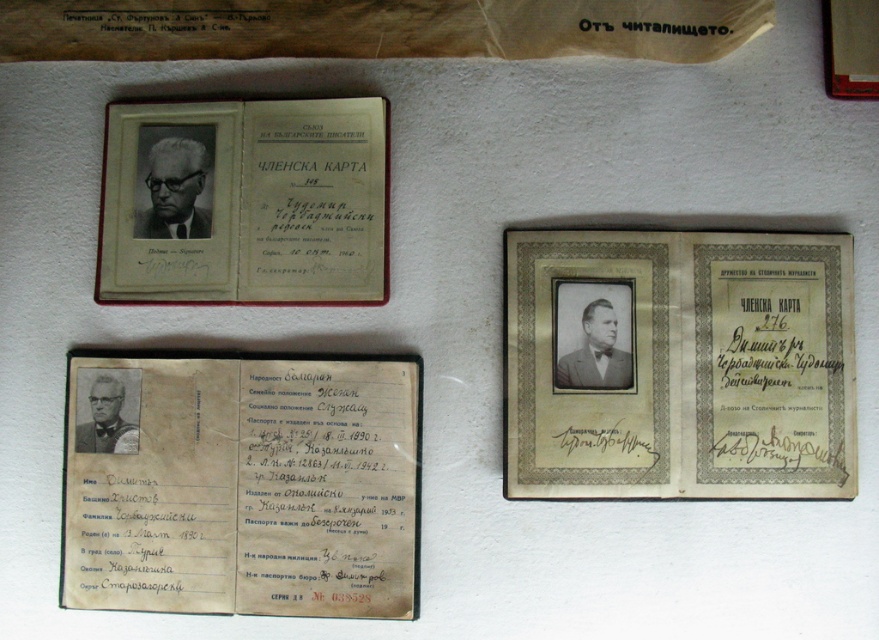
Does gold textured paper at center have a larger size compared to yellowed paper passport at center?

No.

Does gold textured paper at center appear over yellowed paper passport at center?

Yes.

Is point (774, 243) farther from viewer compared to point (182, 432)?

Yes, it is behind point (182, 432).

This screenshot has width=879, height=640. I want to click on gold textured paper at center, so (679, 364).

Is gold textured paper at center positioned in front of matte paper membership card at upper left?

Yes, it is in front of matte paper membership card at upper left.

Between gold textured paper at center and matte paper membership card at upper left, which one is positioned lower?

gold textured paper at center is lower down.

Is point (834, 237) positioned before point (190, 248)?

Yes, it is in front of point (190, 248).

Find the location of a particular element. This screenshot has height=640, width=879. gold textured paper at center is located at coordinates (679, 364).

Is yellowed paper passport at center shorter than matte paper membership card at upper left?

No, yellowed paper passport at center is not shorter than matte paper membership card at upper left.

Which of these two, yellowed paper passport at center or matte paper membership card at upper left, stands shorter?

Standing shorter between the two is matte paper membership card at upper left.

Image resolution: width=879 pixels, height=640 pixels. Describe the element at coordinates (240, 484) in the screenshot. I see `yellowed paper passport at center` at that location.

Where is `yellowed paper passport at center`? The image size is (879, 640). yellowed paper passport at center is located at coordinates (240, 484).